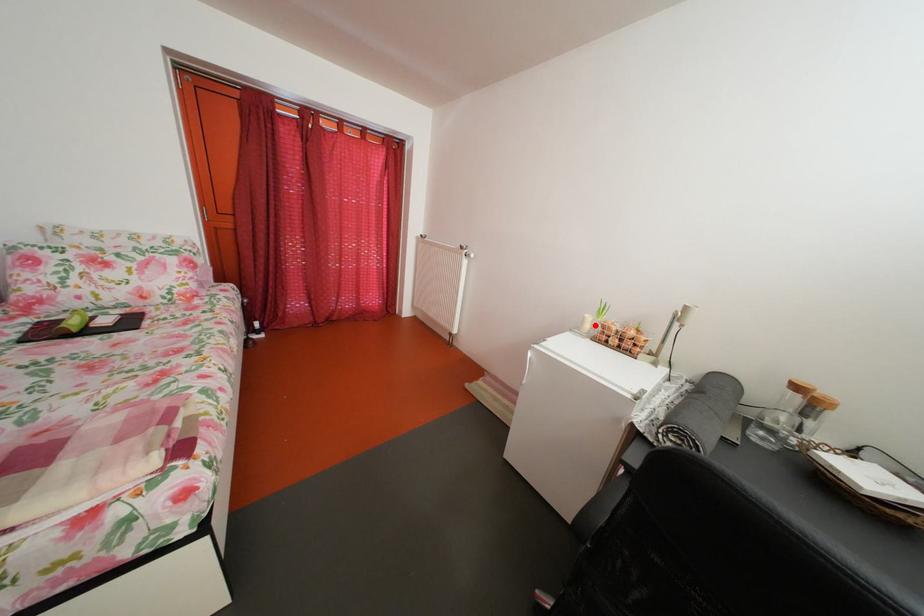
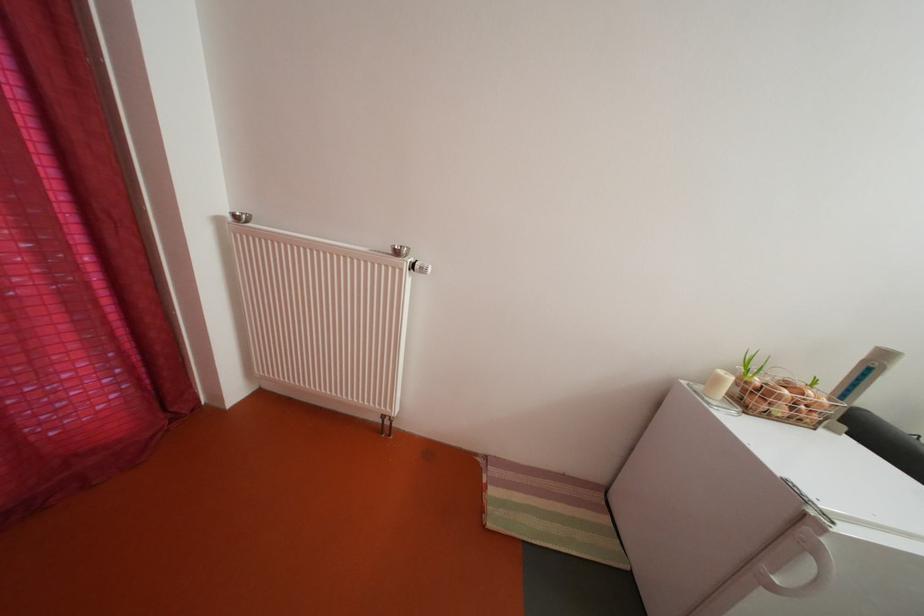
Find the pixel in the second image that matches the highlighted location in the first image.

(728, 386)